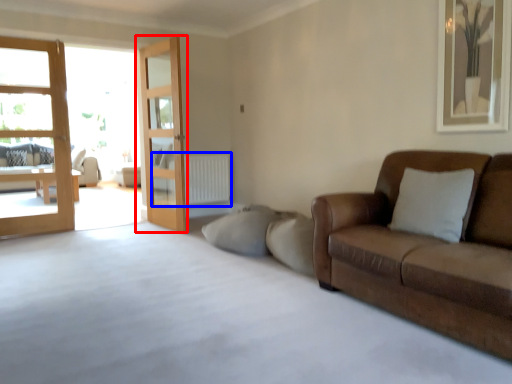
Question: Among these objects, which one is farthest to the camera, door (highlighted by a red box) or radiator (highlighted by a blue box)?

Choices:
 (A) door
 (B) radiator

Answer: (B)